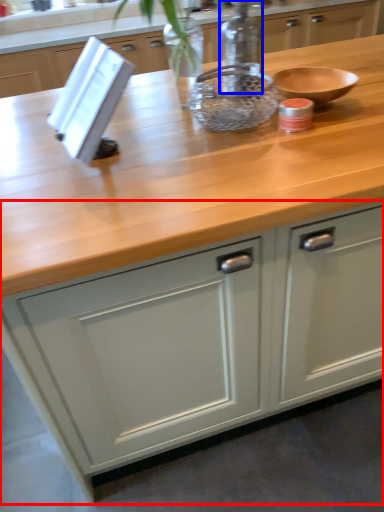
Question: Which object is further to the camera taking this photo, cabinetry (highlighted by a red box) or bottle (highlighted by a blue box)?

Choices:
 (A) cabinetry
 (B) bottle

Answer: (B)